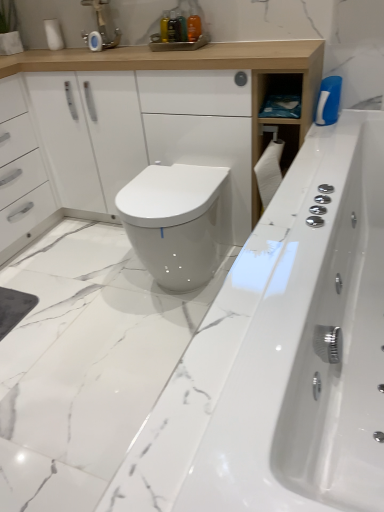
The height and width of the screenshot is (512, 384). In order to click on free space to the left of white glossy bidet at center in this screenshot , I will do `click(92, 290)`.